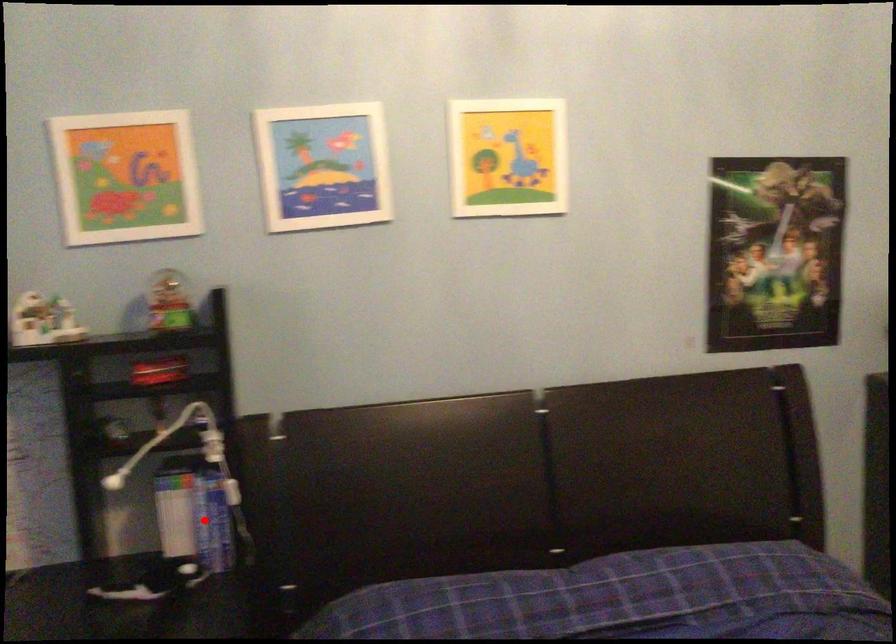
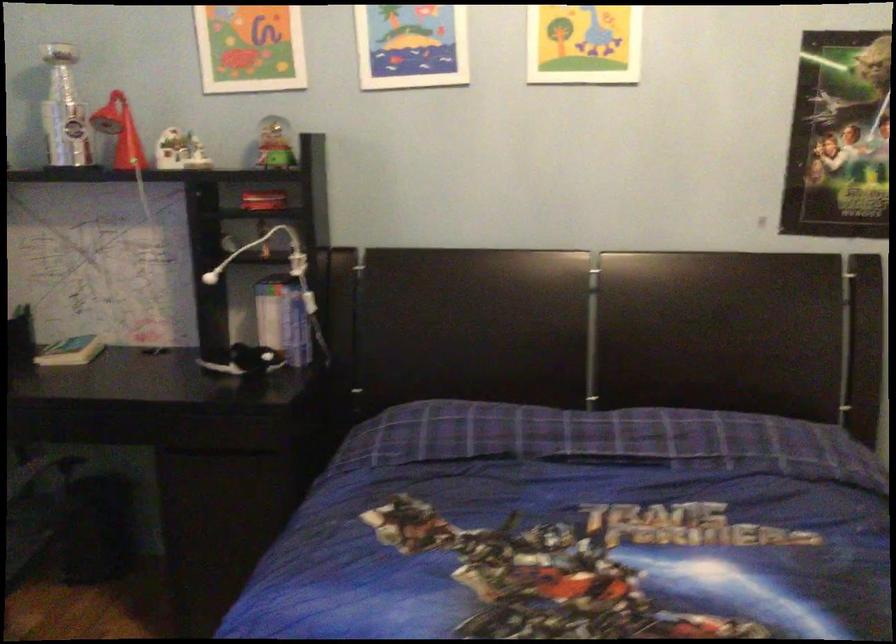
Question: A red point is marked in image1. In image2, is the corresponding 3D point closer to the camera or farther? Reply with the corresponding letter.

Choices:
 (A) The corresponding 3D point is closer.
 (B) The corresponding 3D point is farther.

Answer: (B)